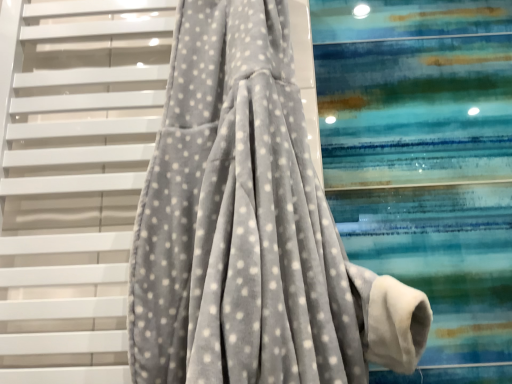
Measure the distance between velvet grey robe at center and camera.

→ They are 19.87 inches apart.

Describe the element at coordinates (250, 227) in the screenshot. The height and width of the screenshot is (384, 512). I see `velvet grey robe at center` at that location.

The width and height of the screenshot is (512, 384). Identify the location of velvet grey robe at center. (250, 227).

Where is `gray velvety fabric at center`? Image resolution: width=512 pixels, height=384 pixels. gray velvety fabric at center is located at coordinates (76, 182).

This screenshot has width=512, height=384. Describe the element at coordinates (76, 182) in the screenshot. I see `gray velvety fabric at center` at that location.

Identify the location of velvet grey robe at center. (250, 227).

Considering the relative positions of gray velvety fabric at center and velvet grey robe at center in the image provided, is gray velvety fabric at center to the left of velvet grey robe at center from the viewer's perspective?

Correct, you'll find gray velvety fabric at center to the left of velvet grey robe at center.

Considering their positions, is gray velvety fabric at center located in front of or behind velvet grey robe at center?

gray velvety fabric at center is positioned farther from the viewer than velvet grey robe at center.

Which point is more distant from viewer, (51,217) or (214,74)?

The point (51,217) is more distant.

From the image's perspective, is gray velvety fabric at center under velvet grey robe at center?

Indeed, from the image's perspective, gray velvety fabric at center is shown beneath velvet grey robe at center.

From a real-world perspective, which is physically below, gray velvety fabric at center or velvet grey robe at center?

velvet grey robe at center.

Considering the sizes of objects gray velvety fabric at center and velvet grey robe at center in the image provided, who is thinner, gray velvety fabric at center or velvet grey robe at center?

gray velvety fabric at center is thinner.

From their relative heights in the image, would you say gray velvety fabric at center is taller or shorter than velvet grey robe at center?

Clearly, gray velvety fabric at center is taller compared to velvet grey robe at center.

Is gray velvety fabric at center smaller than velvet grey robe at center?

Indeed, gray velvety fabric at center has a smaller size compared to velvet grey robe at center.

Is gray velvety fabric at center inside the boundaries of velvet grey robe at center, or outside?

gray velvety fabric at center lies outside velvet grey robe at center.

Are gray velvety fabric at center and velvet grey robe at center far apart?

No.

Could you tell me if gray velvety fabric at center is turned towards velvet grey robe at center?

Yes, gray velvety fabric at center is aimed at velvet grey robe at center.

Where is `stairs below the velvet grey robe at center (from the image's perspective)`? The width and height of the screenshot is (512, 384). stairs below the velvet grey robe at center (from the image's perspective) is located at coordinates (76, 182).

Is velvet grey robe at center to the left or to the right of gray velvety fabric at center in the image?

From the image, it's evident that velvet grey robe at center is to the right of gray velvety fabric at center.

Is velvet grey robe at center closer to the viewer compared to gray velvety fabric at center?

Yes, the depth of velvet grey robe at center is less than that of gray velvety fabric at center.

Is point (189, 109) closer to camera compared to point (99, 248)?

No, it is not.

From the image's perspective, is velvet grey robe at center over gray velvety fabric at center?

Yes, from the image's perspective, velvet grey robe at center is over gray velvety fabric at center.

From the picture: From a real-world perspective, is velvet grey robe at center physically above gray velvety fabric at center?

Actually, velvet grey robe at center is physically below gray velvety fabric at center in the real world.

Which of these two, velvet grey robe at center or gray velvety fabric at center, is thinner?

gray velvety fabric at center.

Does velvet grey robe at center have a greater height compared to gray velvety fabric at center?

No.

Between velvet grey robe at center and gray velvety fabric at center, which one has larger size?

velvet grey robe at center is bigger.

Do you think velvet grey robe at center is within gray velvety fabric at center, or outside of it?

velvet grey robe at center exists outside the volume of gray velvety fabric at center.

Is velvet grey robe at center beside gray velvety fabric at center?

No.

Could you tell me if velvet grey robe at center is turned towards gray velvety fabric at center?

No.

Measure the distance from velvet grey robe at center to gray velvety fabric at center.

A distance of 6.73 inches exists between velvet grey robe at center and gray velvety fabric at center.

The width and height of the screenshot is (512, 384). Identify the location of stairs behind the velvet grey robe at center. [x=76, y=182].

Locate an element on the screen. The width and height of the screenshot is (512, 384). curtain located on the right of gray velvety fabric at center is located at coordinates (250, 227).

Locate an element on the screen. Image resolution: width=512 pixels, height=384 pixels. curtain beneath the gray velvety fabric at center (from a real-world perspective) is located at coordinates (250, 227).